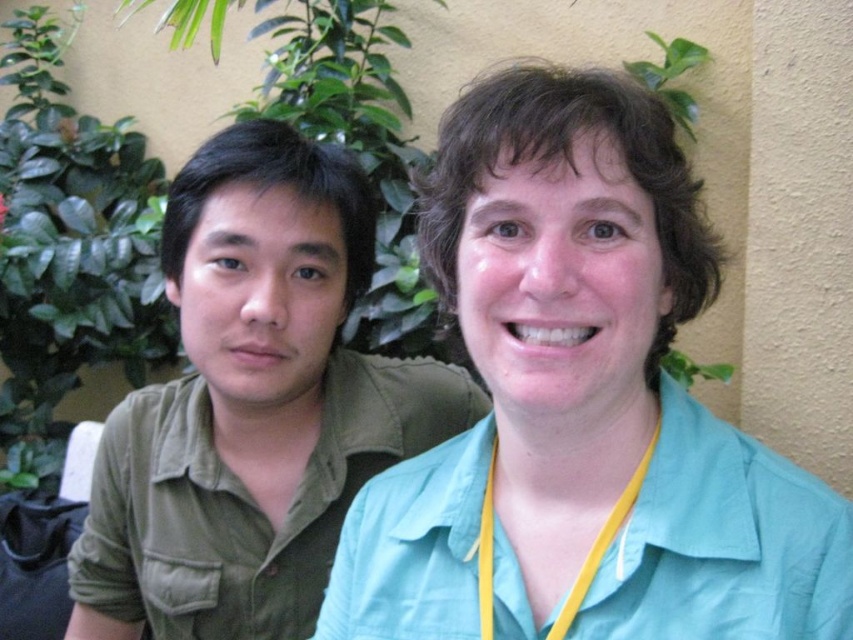
Can you confirm if matte green shirt at left is thinner than yellow fabric lanyard at center?

No, matte green shirt at left is not thinner than yellow fabric lanyard at center.

Which is behind, point (305, 433) or point (561, 609)?

Point (305, 433)

Between point (254, 445) and point (488, 605), which one is positioned behind?

The point (254, 445) is more distant.

This screenshot has width=853, height=640. Find the location of `matte green shirt at left`. matte green shirt at left is located at coordinates (265, 412).

Which is behind, point (326, 465) or point (491, 474)?

The point (326, 465) is more distant.

Between point (222, 625) and point (492, 470), which one is positioned behind?

Point (222, 625)

The image size is (853, 640). In order to click on green matte shirt at left in this screenshot , I will do `click(235, 380)`.

Between point (264, 417) and point (676, 100), which one is positioned behind?

The point (676, 100) is more distant.

Does matte green shirt at left appear on the left side of green leafy plant at upper right?

Yes, matte green shirt at left is to the left of green leafy plant at upper right.

Between point (306, 429) and point (674, 113), which one is positioned behind?

The point (674, 113) is behind.

Identify the location of matte green shirt at left. (265, 412).